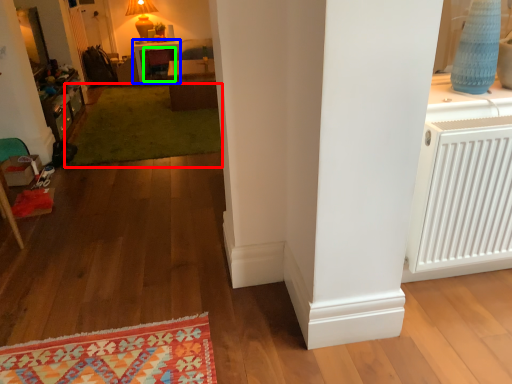
Question: Which object is positioned closest to mat (highlighted by a red box)? Select from table (highlighted by a blue box) and armchair (highlighted by a green box).

Choices:
 (A) table
 (B) armchair

Answer: (B)